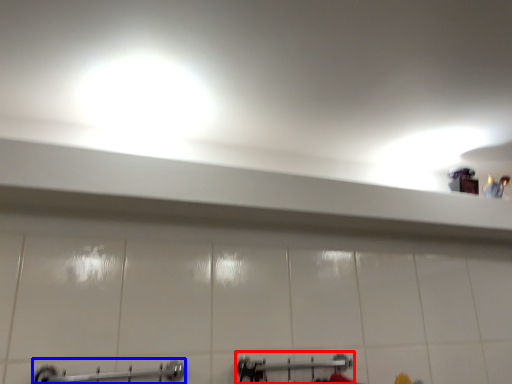
Question: Among these objects, which one is farthest to the camera, shower (highlighted by a red box) or towel rack (highlighted by a blue box)?

Choices:
 (A) shower
 (B) towel rack

Answer: (A)